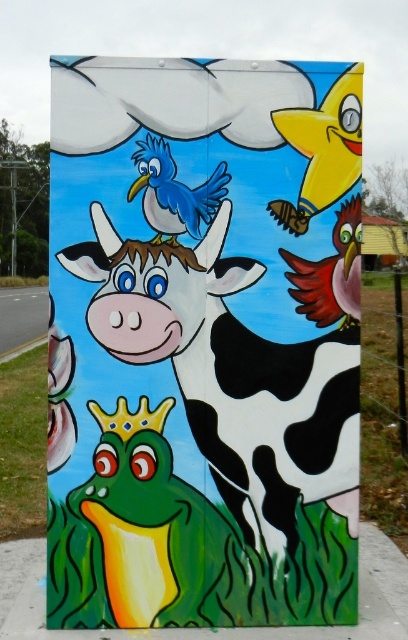
Does shiny blue bird at center have a lesser height compared to matte blue bird at upper center?

No, shiny blue bird at center is not shorter than matte blue bird at upper center.

Is shiny blue bird at center bigger than matte blue bird at upper center?

Yes, shiny blue bird at center is bigger than matte blue bird at upper center.

Is point (68, 616) behind point (175, 237)?

Yes, it is behind point (175, 237).

This screenshot has width=408, height=640. Find the location of `shiny blue bird at center`. shiny blue bird at center is located at coordinates (139, 536).

Who is positioned more to the right, shiny blue bird at center or shiny red bird at center right?

Positioned to the right is shiny red bird at center right.

Between shiny blue bird at center and shiny red bird at center right, which one is positioned lower?

shiny blue bird at center is lower down.

Does point (117, 592) lie behind point (301, 308)?

That is True.

Locate an element on the screen. The image size is (408, 640). shiny blue bird at center is located at coordinates (139, 536).

Does point (106, 486) come in front of point (345, 323)?

Yes, it is in front of point (345, 323).

Does matte black cow at center appear over shiny red bird at center right?

No.

What do you see at coordinates (204, 342) in the screenshot? I see `matte black cow at center` at bounding box center [204, 342].

Locate an element on the screen. The image size is (408, 640). matte black cow at center is located at coordinates (204, 342).